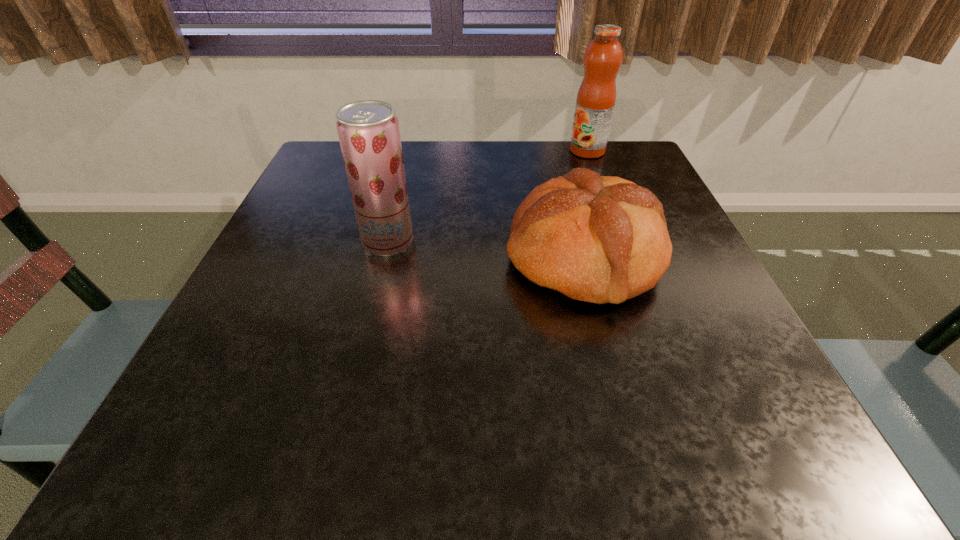
Identify the location of free space that is in between the leftmost object and the farthest object. (488, 196).

Locate an element on the screen. The height and width of the screenshot is (540, 960). free spot between the farther fruit juice and the leftmost object is located at coordinates (488, 196).

Image resolution: width=960 pixels, height=540 pixels. I want to click on vacant area that lies between the bread and the left fruit juice, so click(487, 249).

Find the location of a particular element. The height and width of the screenshot is (540, 960). vacant point located between the shortest object and the left fruit juice is located at coordinates (487, 249).

The width and height of the screenshot is (960, 540). I want to click on free space between the nearer fruit juice and the shortest object, so click(487, 249).

Locate which object is the closest to the left fruit juice. Please provide its 2D coordinates. Your answer should be formatted as a tuple, i.e. [(x, y)], where the tuple contains the x and y coordinates of a point satisfying the conditions above.

[(601, 239)]

Identify which object is the closest to the leftmost object. Please provide its 2D coordinates. Your answer should be formatted as a tuple, i.e. [(x, y)], where the tuple contains the x and y coordinates of a point satisfying the conditions above.

[(601, 239)]